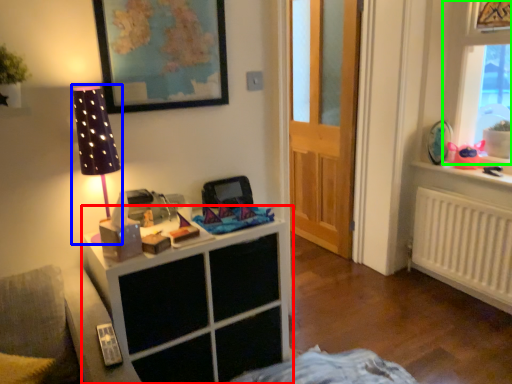
Question: Considering the real-world distances, which object is farthest from cabinetry (highlighted by a red box)? table lamp (highlighted by a blue box) or window (highlighted by a green box)?

Choices:
 (A) table lamp
 (B) window

Answer: (B)